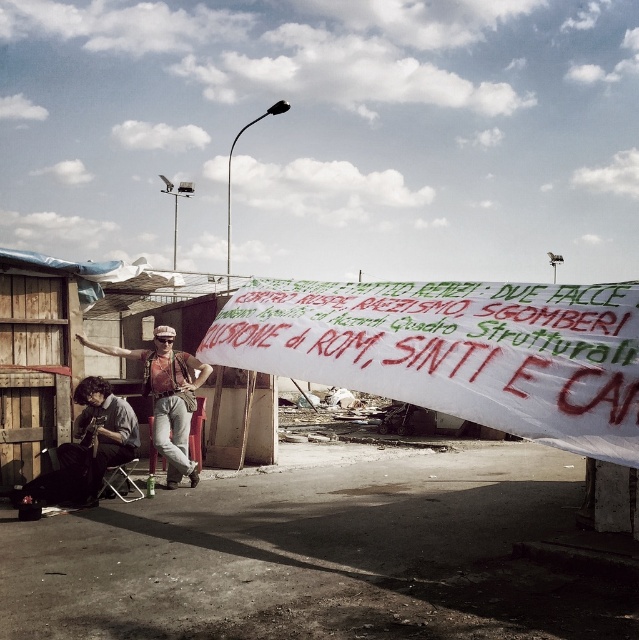
Can you confirm if white paper banner at center is positioned above denim jacket at lower left?

Correct, white paper banner at center is located above denim jacket at lower left.

Is white paper banner at center closer to camera compared to denim jacket at lower left?

Yes, white paper banner at center is in front of denim jacket at lower left.

Which is in front, point (387, 339) or point (144, 376)?

Point (387, 339) is in front.

I want to click on white paper banner at center, so click(x=456, y=349).